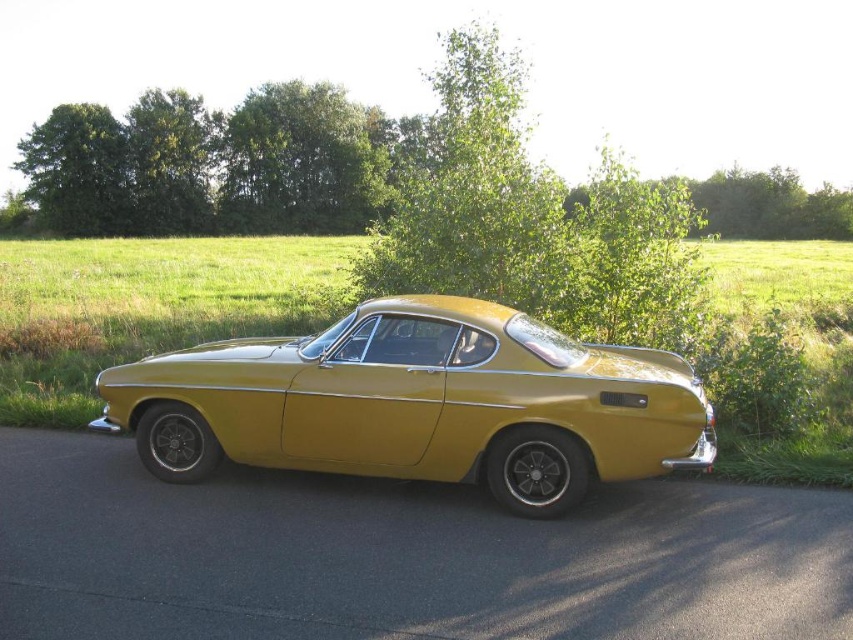
The image size is (853, 640). What do you see at coordinates (418, 403) in the screenshot?
I see `metallic gold car at center` at bounding box center [418, 403].

Looking at this image, between metallic gold car at center and green leafy trees at upper left, which one has less height?

metallic gold car at center

Does point (173, 364) come in front of point (120, 176)?

Yes, it is in front of point (120, 176).

At what (x,y) coordinates should I click in order to perform the action: click on metallic gold car at center. Please return your answer as a coordinate pair (x, y). This screenshot has height=640, width=853. Looking at the image, I should click on (418, 403).

Is metallic gold car at center to the left of green leafy tree at center from the viewer's perspective?

Correct, you'll find metallic gold car at center to the left of green leafy tree at center.

Is metallic gold car at center shorter than green leafy tree at center?

Correct, metallic gold car at center is not as tall as green leafy tree at center.

Does point (430, 300) lie in front of point (724, 186)?

Yes, it is.

Locate an element on the screen. The height and width of the screenshot is (640, 853). metallic gold car at center is located at coordinates (418, 403).

Measure the distance from green leafy trees at upper left to green leafy tree at center.

green leafy trees at upper left and green leafy tree at center are 158.10 feet apart from each other.

Does green leafy trees at upper left appear on the left side of green leafy tree at center?

Correct, you'll find green leafy trees at upper left to the left of green leafy tree at center.

This screenshot has height=640, width=853. What do you see at coordinates (212, 164) in the screenshot?
I see `green leafy trees at upper left` at bounding box center [212, 164].

Find the location of a particular element. This screenshot has width=853, height=640. green leafy trees at upper left is located at coordinates (212, 164).